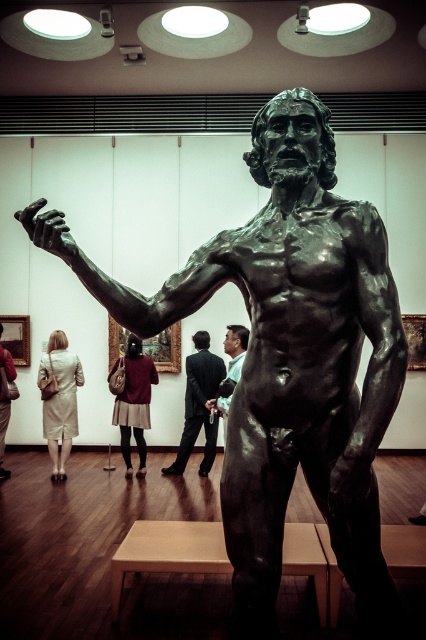
You are an art curator planning to install a new sculpture in the gallery. You notice the matte brown skirt at center and the bronze statue at center. Which object is smaller and should be placed on a lower shelf for better visibility?

The matte brown skirt at center is smaller than the bronze statue at center, so it should be placed on a lower shelf to ensure it is visible to visitors.

You are an art curator preparing to install a new exhibit. You have two items to place in the gallery scene described. The items are the light beige coat at lower left and the matte brown skirt at center. Based on their sizes, which item will require more vertical space when displayed?

The light beige coat at lower left requires more vertical space because it is much taller than the matte brown skirt at center.